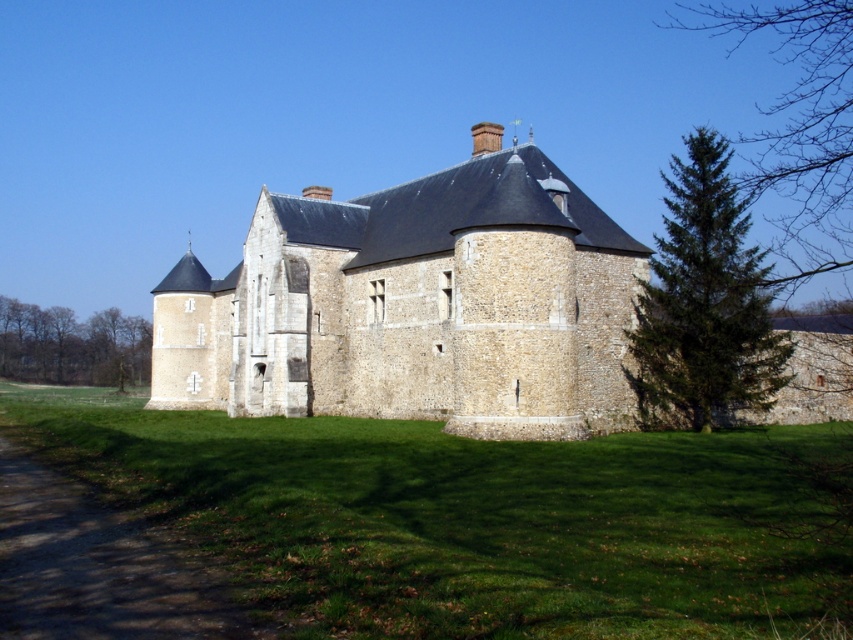
Between point (393, 365) and point (641, 340), which one is positioned in front?

Point (641, 340) is in front.

Is stone castle at center wider than green coniferous tree at right?

Yes.

Who is more distant from viewer, (584, 244) or (647, 284)?

The point (647, 284) is behind.

Where is `stone castle at center`? The width and height of the screenshot is (853, 640). stone castle at center is located at coordinates (415, 305).

Does green coniferous tree at upper right have a greater height compared to brown textured tree at left?

Indeed, green coniferous tree at upper right has a greater height compared to brown textured tree at left.

Between point (839, 154) and point (41, 372), which one is positioned in front?

Positioned in front is point (839, 154).

Is point (846, 170) more distant than point (65, 316)?

That is False.

Where is `green coniferous tree at upper right`? green coniferous tree at upper right is located at coordinates (799, 128).

Does stone castle at center have a larger size compared to green coniferous tree at upper right?

Actually, stone castle at center might be smaller than green coniferous tree at upper right.

Does stone castle at center have a greater height compared to green coniferous tree at upper right?

No.

Is point (445, 228) more distant than point (808, 193)?

No, (445, 228) is closer to viewer.

I want to click on stone castle at center, so click(415, 305).